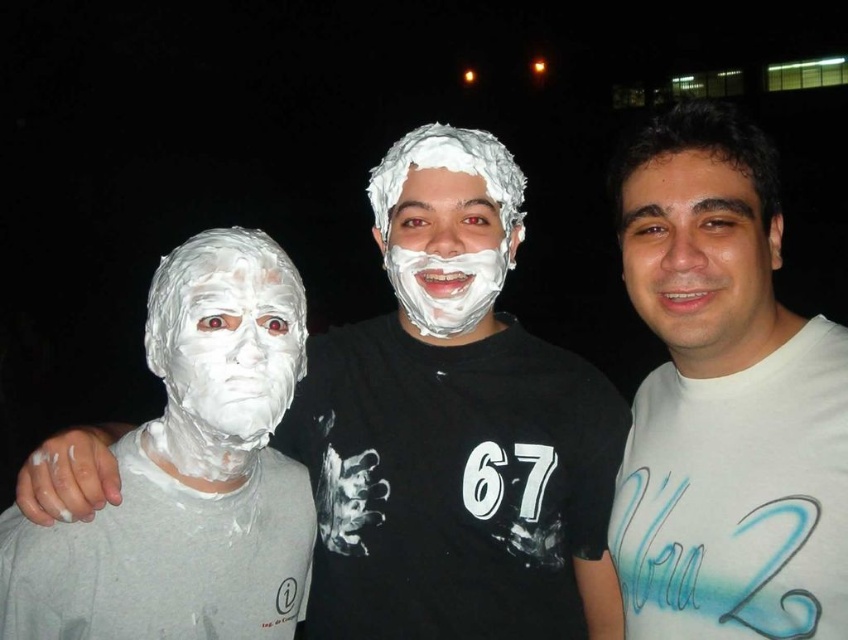
You are a photographer who just took a nighttime group photo. You notice two elements in the image related to the person in the middle. The first is their white matte shirt at center and the second is their smooth skin face at center. Based on their positions, which one is closer to the camera?

The smooth skin face at center is closer to the camera than the white matte shirt at center because the shirt is positioned below the face.

Consider the image. Based on the scene description, can you determine if the white matte shirt at center is wider than the smooth skin face at center?

The white matte shirt at center might be wider than the smooth skin face at center according to the objects description.